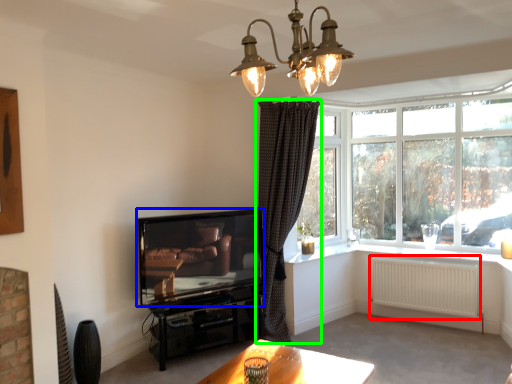
Question: Estimate the real-world distances between objects in this image. Which object is farther from radiator (highlighted by a red box), television (highlighted by a blue box) or curtain (highlighted by a green box)?

Choices:
 (A) television
 (B) curtain

Answer: (A)